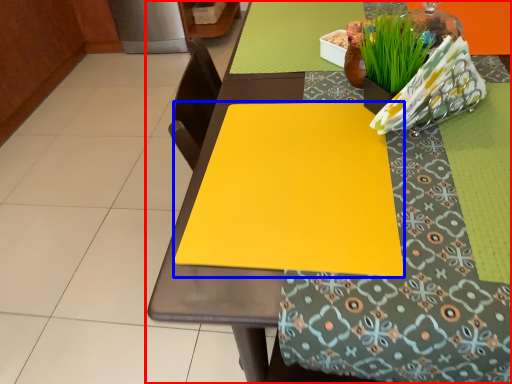
Question: Which point is further to the camera, table (highlighted by a red box) or sheet (highlighted by a blue box)?

Choices:
 (A) table
 (B) sheet

Answer: (B)